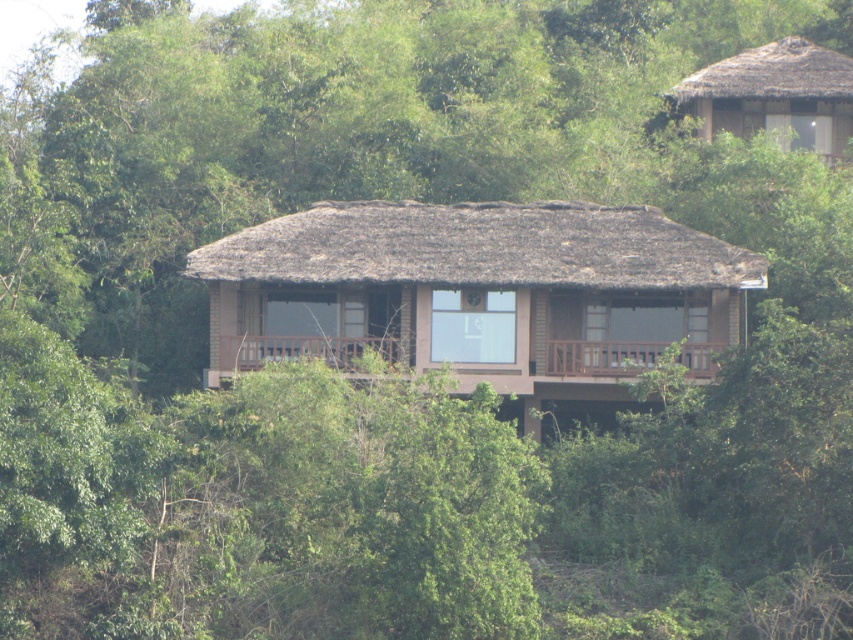
Between point (407, 228) and point (753, 86), which one is positioned behind?

Positioned behind is point (753, 86).

You are a GUI agent. You are given a task and a screenshot of the screen. Output one action in this format:
    pyautogui.click(x=<x>, y=<y>)
    Task: Click on the brown thatched roof hut at center
    The height and width of the screenshot is (640, 853).
    Given the screenshot: What is the action you would take?
    coord(479,292)